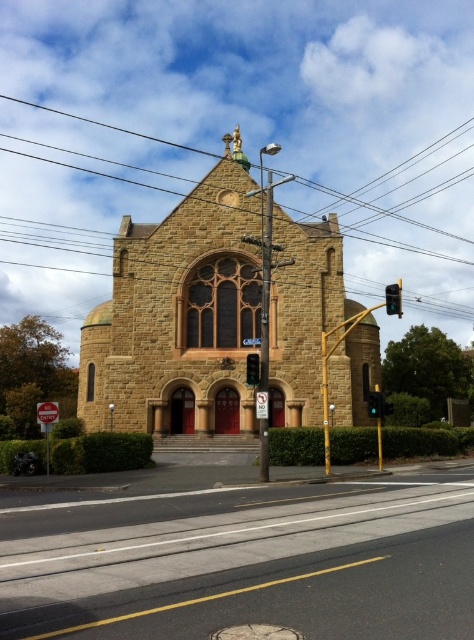
You are a city planner assessing the visibility of traffic lights near landmarks. Given the scene, will the green glass traffic light at center be easily visible to drivers approaching the golden stone church at center?

The golden stone church at center has a larger size compared to the green glass traffic light at center. This means the traffic light might be less visible to drivers approaching the church, as it is smaller in size relative to the prominent church structure.

You are standing at the intersection and want to take a photo of the golden stone church at center. Where should you position yourself to capture it in the frame?

The golden stone church at center is located at point (180,316), so positioning yourself directly in front of it at the intersection would ensure it is centered in your photo.